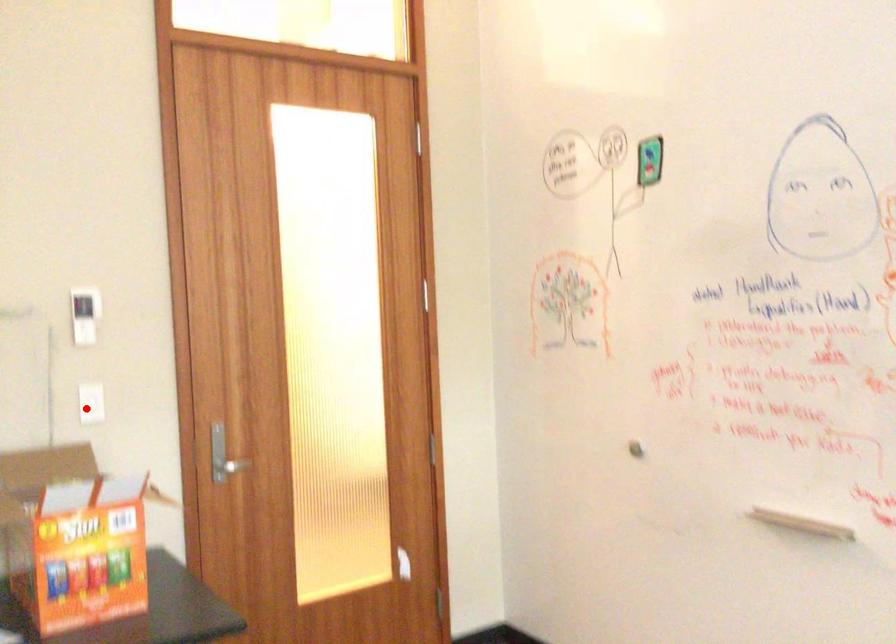
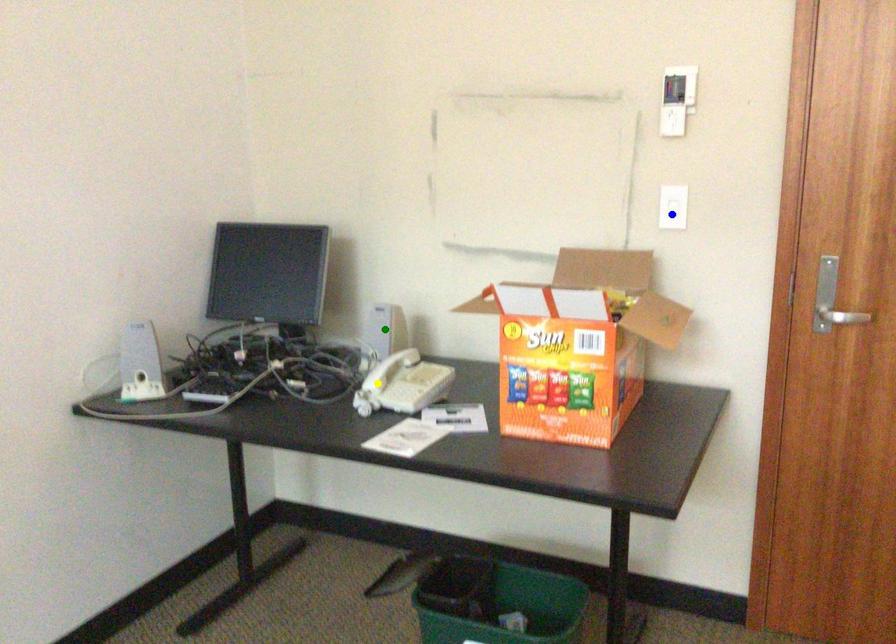
Question: I am providing you with two images of the same scene from different viewpoints. A red point is marked on the first image. You are given multiple points on the second image. Can you choose the point in image 2 that corresponds to the point in image 1?

Choices:
 (A) yellow point
 (B) blue point
 (C) green point

Answer: (B)